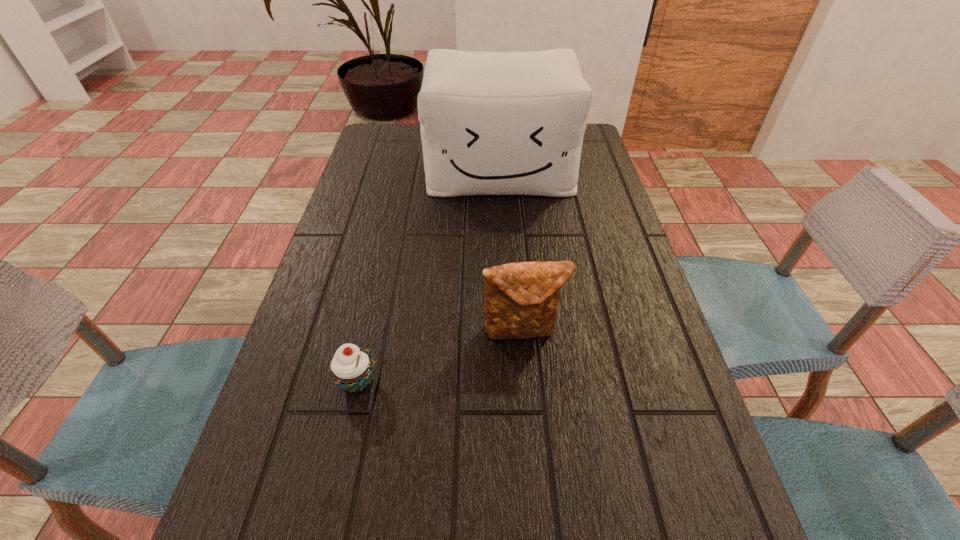
The width and height of the screenshot is (960, 540). What are the coordinates of `vacant space that is in between the shortest object and the second tallest object` in the screenshot? It's located at (440, 356).

Where is `vacant region between the nearest object and the cushion`? vacant region between the nearest object and the cushion is located at coordinates (428, 275).

I want to click on object identified as the closest to the second nearest object, so (351, 367).

Identify which object is the second nearest to the clutch bag. Please provide its 2D coordinates. Your answer should be formatted as a tuple, i.e. [(x, y)], where the tuple contains the x and y coordinates of a point satisfying the conditions above.

[(492, 123)]